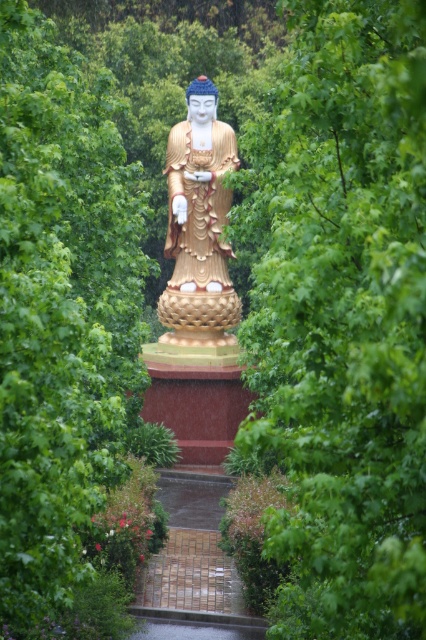
Consider the image. Can you confirm if green leafy tree at center is shorter than green leafy bush at center?

No.

Find the location of a particular element. The image size is (426, 640). green leafy tree at center is located at coordinates (345, 321).

Who is more distant from viewer, (285, 388) or (101, 432)?

Point (101, 432)

Identify the location of green leafy tree at center. The image size is (426, 640). (345, 321).

At what (x,y) coordinates should I click in order to perform the action: click on green leafy tree at center. Please return your answer as a coordinate pair (x, y). Looking at the image, I should click on (345, 321).

Between green leafy tree at center and gold polished statue at center, which one appears on the left side from the viewer's perspective?

gold polished statue at center is more to the left.

Is point (374, 332) in front of point (199, 83)?

Yes, point (374, 332) is closer to viewer.

Image resolution: width=426 pixels, height=640 pixels. What are the coordinates of `green leafy tree at center` in the screenshot? It's located at (345, 321).

How much distance is there between green leafy bush at center and gold polished statue at center?

The distance of green leafy bush at center from gold polished statue at center is 18.01 meters.

Is green leafy bush at center behind gold polished statue at center?

No, green leafy bush at center is closer to the viewer.

I want to click on green leafy bush at center, so click(x=60, y=310).